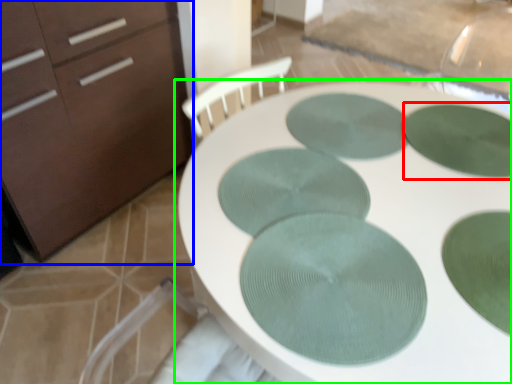
Question: Based on their relative distances, which object is nearer to glass plate (highlighted by a red box)? Choose from chest of drawers (highlighted by a blue box) and table (highlighted by a green box).

Choices:
 (A) chest of drawers
 (B) table

Answer: (B)